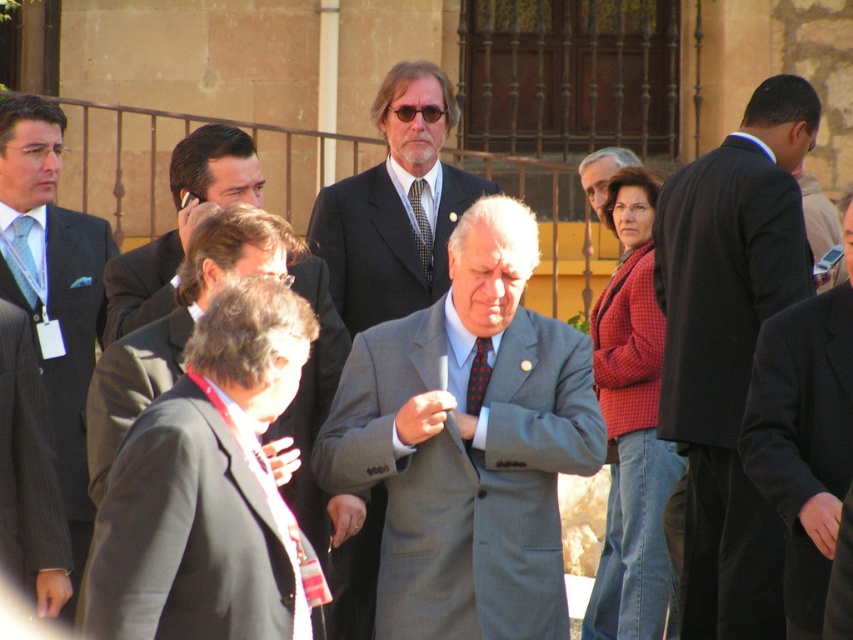
You are organizing a professional event and need to arrange seating based on the attendees clothing. You see a gray suit at center and a black dotted tie at center. Which clothing item should be seated closer to the front of the room?

The gray suit at center should be seated closer to the front since it is already positioned in front of the black dotted tie at center in the image.

You are a photographer at the event and need to capture a clear photo of both the light blue pinstripe suit at left and the black dotted tie at center. Can you see both objects in the same frame without moving the camera?

The black dotted tie at center is behind the light blue pinstripe suit at left, so it might be partially obscured. Adjust the camera angle to ensure both are visible.

You are a photographer at this event and need to ensure that the light blue pinstripe suit at left and the black dotted tie at center are both visible in the photo. Given their sizes, which one might require more careful framing to ensure it doesn not get lost in the composition?

The black dotted tie at center is smaller in size compared to the light blue pinstripe suit at left, so it might require more careful framing to ensure it doesn not get lost in the composition.